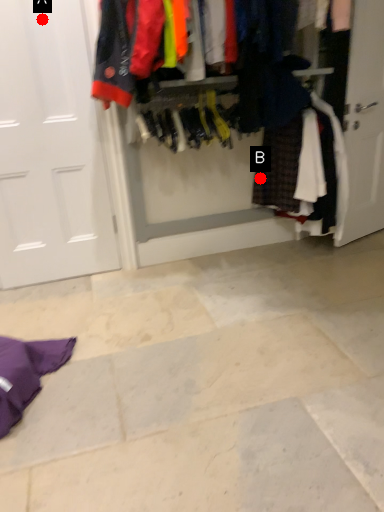
Question: Two points are circled on the image, labeled by A and B beside each circle. Which point appears closest to the camera in this image?

Choices:
 (A) A is closer
 (B) B is closer

Answer: (A)